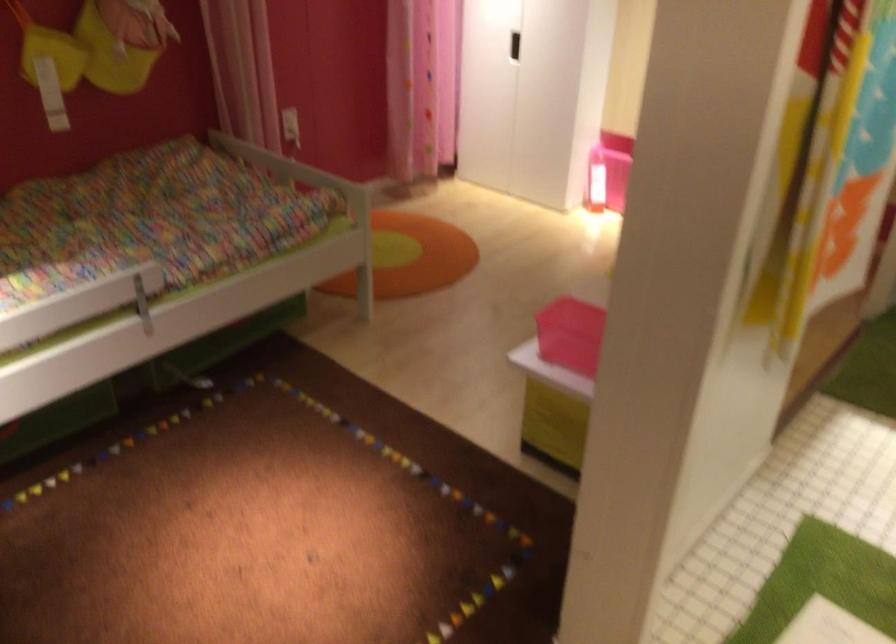
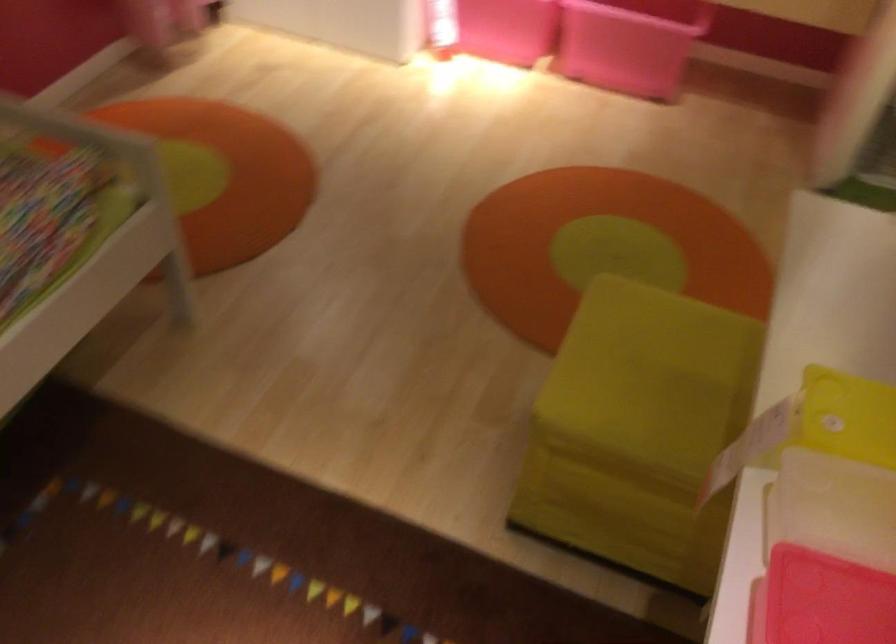
First-person continuous shooting, in which direction is the camera rotating?

The camera rotated toward right-down.